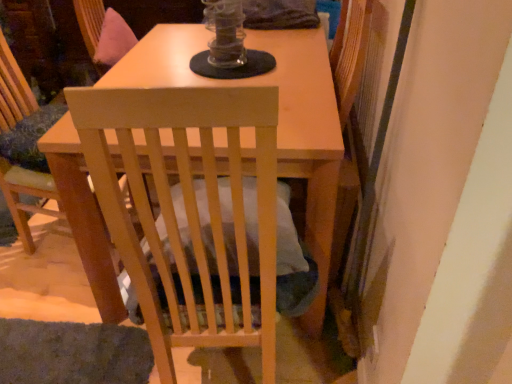
You are a GUI agent. You are given a task and a screenshot of the screen. Output one action in this format:
    pyautogui.click(x=<x>, y=<y>)
    Task: Click on the wooden swivel chair at upper center
    This screenshot has width=512, height=384.
    Given the screenshot: What is the action you would take?
    pyautogui.click(x=103, y=33)

The width and height of the screenshot is (512, 384). Describe the element at coordinates (103, 33) in the screenshot. I see `wooden swivel chair at upper center` at that location.

Identify the location of light wood chair at center, the 1th chair from the left. The width and height of the screenshot is (512, 384). (26, 194).

This screenshot has width=512, height=384. What are the coordinates of `light wood chair at center, the 1th chair when ordered from right to left` in the screenshot? It's located at (186, 203).

Is light wood chair at center, the 1th chair from the left, not close to wooden swivel chair at upper center?

light wood chair at center, the 1th chair from the left, is near wooden swivel chair at upper center, not far away.

Would you say light wood chair at center, the 1th chair from the left, is inside or outside wooden swivel chair at upper center?

light wood chair at center, the 1th chair from the left, is not inside wooden swivel chair at upper center, it's outside.

Based on their positions, is light wood chair at center, the 1th chair from the left, located to the left or right of wooden swivel chair at upper center?

light wood chair at center, the 1th chair from the left, is positioned on wooden swivel chair at upper center's left side.

Considering the positions of point (26, 169) and point (113, 33), is point (26, 169) closer or farther from the camera than point (113, 33)?

Point (26, 169) appears to be closer to the viewer than point (113, 33).

Considering the sizes of objects light wood chair at center, placed as the 2th chair when sorted from right to left, and light wood chair at center, positioned as the second chair in left-to-right order, in the image provided, who is smaller, light wood chair at center, placed as the 2th chair when sorted from right to left, or light wood chair at center, positioned as the second chair in left-to-right order,?

With smaller size is light wood chair at center, placed as the 2th chair when sorted from right to left.

How many degrees apart are the facing directions of light wood chair at center, the 1th chair from the left, and light wood chair at center, the 1th chair when ordered from right to left?

Result: There is a 104-degree angle between the facing directions of light wood chair at center, the 1th chair from the left, and light wood chair at center, the 1th chair when ordered from right to left.

Who is shorter, light wood chair at center, placed as the 2th chair when sorted from right to left, or light wood chair at center, positioned as the second chair in left-to-right order?

With less height is light wood chair at center, placed as the 2th chair when sorted from right to left.

Which object is positioned more to the left, light wood chair at center, placed as the 2th chair when sorted from right to left, or light wood chair at center, positioned as the second chair in left-to-right order?

Positioned to the left is light wood chair at center, placed as the 2th chair when sorted from right to left.

From a real-world perspective, between wooden swivel chair at upper center and light wood chair at center, the 1th chair from the left, who is vertically higher?

wooden swivel chair at upper center, from a real-world perspective.

Consider the image. Is light wood chair at center, the 1th chair from the left, a part of wooden swivel chair at upper center?

That's incorrect, light wood chair at center, the 1th chair from the left, is not inside wooden swivel chair at upper center.

Is wooden swivel chair at upper center bigger than light wood chair at center, the 1th chair from the left?

No.

Is wooden swivel chair at upper center at the left side of light wood chair at center, the 1th chair from the left?

No, wooden swivel chair at upper center is not to the left of light wood chair at center, the 1th chair from the left.

Consider the image. Between light wood chair at center, positioned as the second chair in left-to-right order, and wooden swivel chair at upper center, which one is positioned in front?

light wood chair at center, positioned as the second chair in left-to-right order, is more forward.

Can you see light wood chair at center, the 1th chair when ordered from right to left, touching wooden swivel chair at upper center?

No.

Which object is thinner, light wood chair at center, the 1th chair when ordered from right to left, or wooden swivel chair at upper center?

With smaller width is wooden swivel chair at upper center.

Measure the distance between light wood chair at center, the 1th chair when ordered from right to left, and wooden swivel chair at upper center.

They are 1.18 meters apart.

Between wooden swivel chair at upper center and light wood chair at center, positioned as the second chair in left-to-right order, which one has smaller width?

wooden swivel chair at upper center.

Can light wood chair at center, the 1th chair when ordered from right to left, be found inside wooden swivel chair at upper center?

No, light wood chair at center, the 1th chair when ordered from right to left, is located outside of wooden swivel chair at upper center.

Is wooden swivel chair at upper center not close to light wood chair at center, positioned as the second chair in left-to-right order?

Yes, wooden swivel chair at upper center and light wood chair at center, positioned as the second chair in left-to-right order, are quite far apart.

Who is shorter, wooden swivel chair at upper center or light wood chair at center, positioned as the second chair in left-to-right order?

wooden swivel chair at upper center.

Considering the relative sizes of light wood chair at center, positioned as the second chair in left-to-right order, and light wood chair at center, the 1th chair from the left, in the image provided, is light wood chair at center, positioned as the second chair in left-to-right order, taller than light wood chair at center, the 1th chair from the left,?

Yes, light wood chair at center, positioned as the second chair in left-to-right order, is taller than light wood chair at center, the 1th chair from the left.

Locate an element on the screen. The image size is (512, 384). chair that is behind the light wood chair at center, the 1th chair when ordered from right to left is located at coordinates (26, 194).

Is point (172, 130) farther from viewer compared to point (19, 168)?

No.

Based on the photo, does light wood chair at center, the 1th chair when ordered from right to left, have a smaller size compared to light wood chair at center, placed as the 2th chair when sorted from right to left?

No, light wood chair at center, the 1th chair when ordered from right to left, is not smaller than light wood chair at center, placed as the 2th chair when sorted from right to left.

Image resolution: width=512 pixels, height=384 pixels. What are the coordinates of `swivel chair behind the light wood chair at center, the 1th chair from the left` in the screenshot? It's located at (103, 33).

The width and height of the screenshot is (512, 384). What are the coordinates of `chair in front of the light wood chair at center, the 1th chair from the left` in the screenshot? It's located at (186, 203).

Estimate the real-world distances between objects in this image. Which object is closer to light wood chair at center, the 1th chair when ordered from right to left, light wood chair at center, the 1th chair from the left, or wooden swivel chair at upper center?

light wood chair at center, the 1th chair from the left, lies closer to light wood chair at center, the 1th chair when ordered from right to left, than the other object.

Considering their positions, is wooden swivel chair at upper center positioned closer to light wood chair at center, the 1th chair from the left, than light wood chair at center, positioned as the second chair in left-to-right order?

wooden swivel chair at upper center is closer to light wood chair at center, the 1th chair from the left.

From the image, which object appears to be farther from wooden swivel chair at upper center, light wood chair at center, placed as the 2th chair when sorted from right to left, or light wood chair at center, the 1th chair when ordered from right to left?

light wood chair at center, the 1th chair when ordered from right to left, is further to wooden swivel chair at upper center.

Estimate the real-world distances between objects in this image. Which object is closer to light wood chair at center, the 1th chair when ordered from right to left, wooden swivel chair at upper center or light wood chair at center, placed as the 2th chair when sorted from right to left?

light wood chair at center, placed as the 2th chair when sorted from right to left, lies closer to light wood chair at center, the 1th chair when ordered from right to left, than the other object.

Based on their spatial positions, is light wood chair at center, the 1th chair when ordered from right to left, or wooden swivel chair at upper center further from light wood chair at center, placed as the 2th chair when sorted from right to left?

light wood chair at center, the 1th chair when ordered from right to left, is further to light wood chair at center, placed as the 2th chair when sorted from right to left.

When comparing their distances from wooden swivel chair at upper center, does light wood chair at center, positioned as the second chair in left-to-right order, or light wood chair at center, the 1th chair from the left, seem further?

Among the two, light wood chair at center, positioned as the second chair in left-to-right order, is located further to wooden swivel chair at upper center.

Where is `chair between light wood chair at center, positioned as the second chair in left-to-right order, and wooden swivel chair at upper center from front to back`? The height and width of the screenshot is (384, 512). chair between light wood chair at center, positioned as the second chair in left-to-right order, and wooden swivel chair at upper center from front to back is located at coordinates (26, 194).